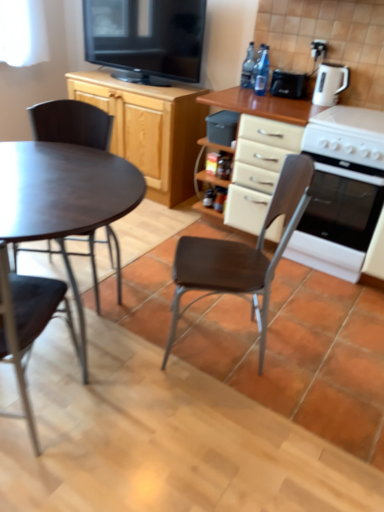
Where is `blank space to the left of transparent plastic bottle at upper center, the second bottle viewed from the back`? This screenshot has height=512, width=384. blank space to the left of transparent plastic bottle at upper center, the second bottle viewed from the back is located at coordinates (250, 89).